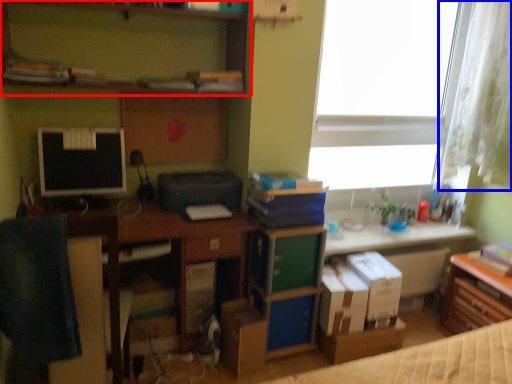
Question: Which object appears farthest to the camera in this image, shelf (highlighted by a red box) or curtain (highlighted by a blue box)?

Choices:
 (A) shelf
 (B) curtain

Answer: (B)